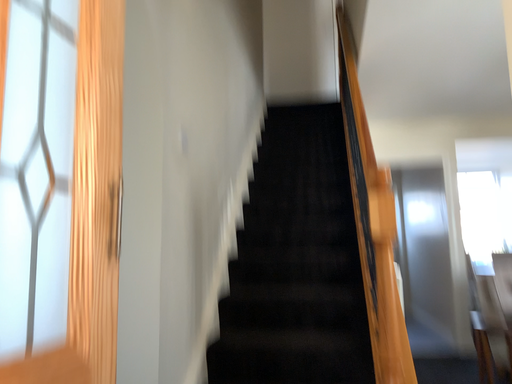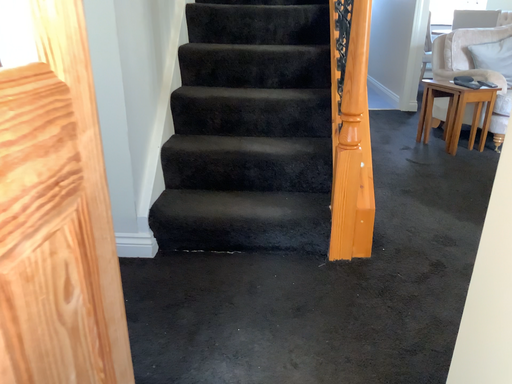
Question: Which way did the camera rotate in the video?

Choices:
 (A) rotated upward
 (B) rotated downward

Answer: (B)